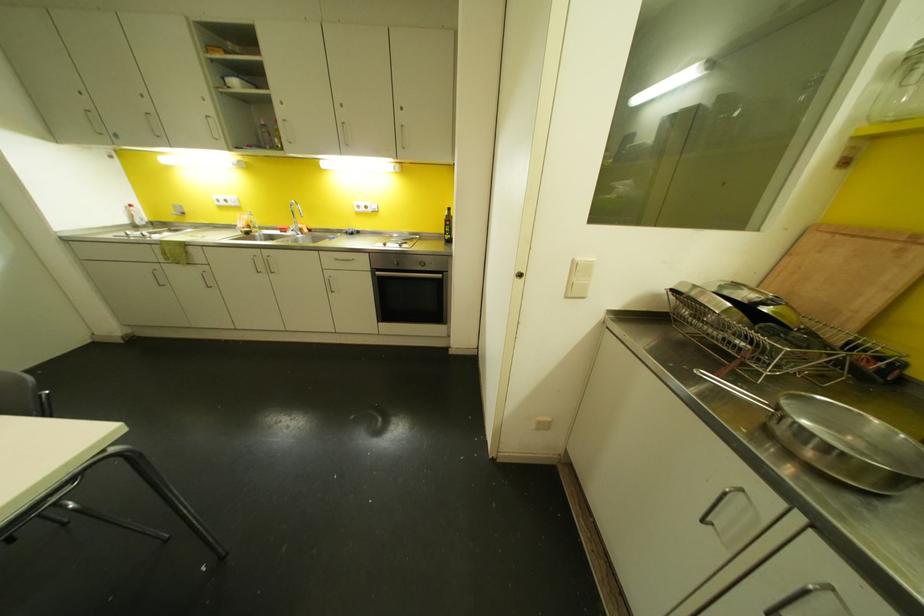
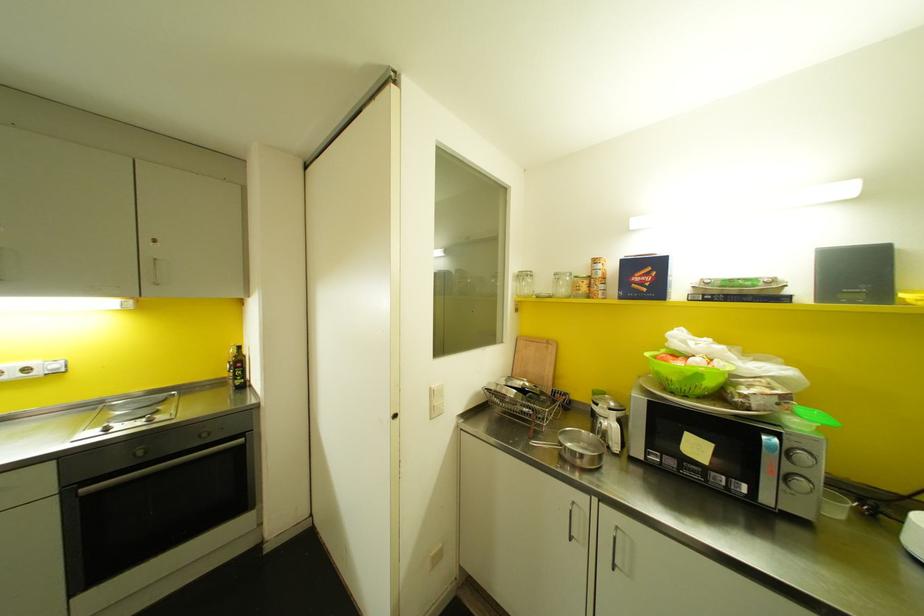
In the second image, find the point that corresponds to (383,244) in the first image.

(106, 429)